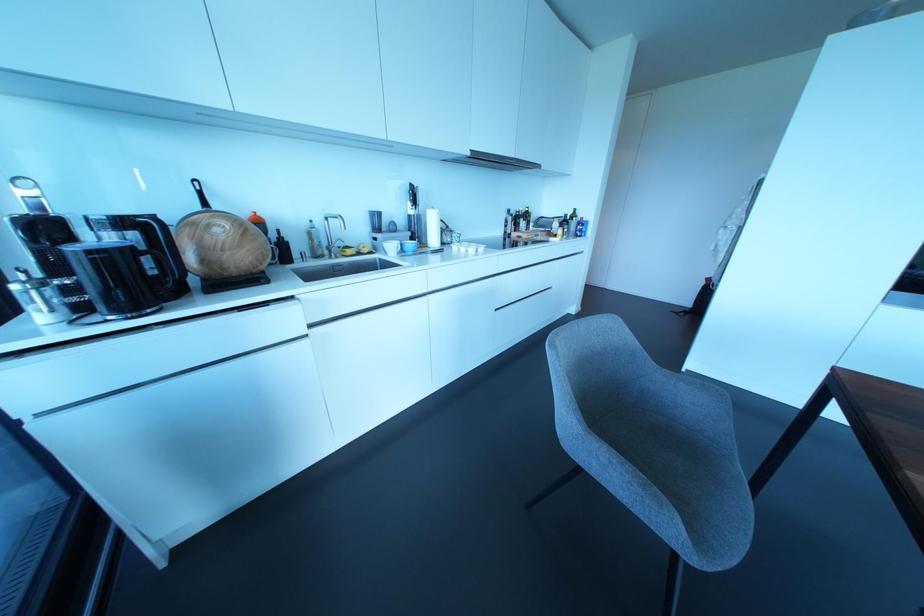
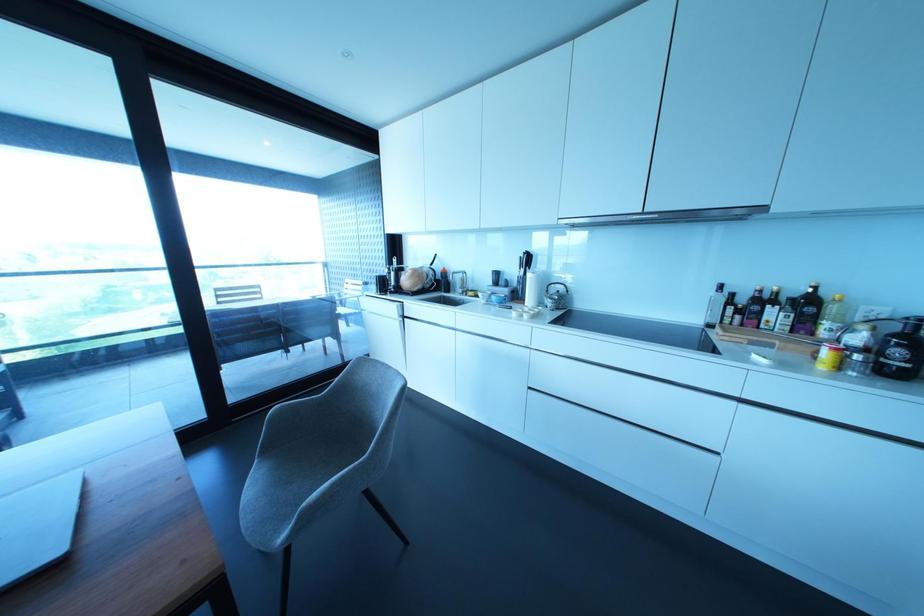
The point at (530, 224) is marked in the first image. Where is the corresponding point in the second image?

(825, 323)